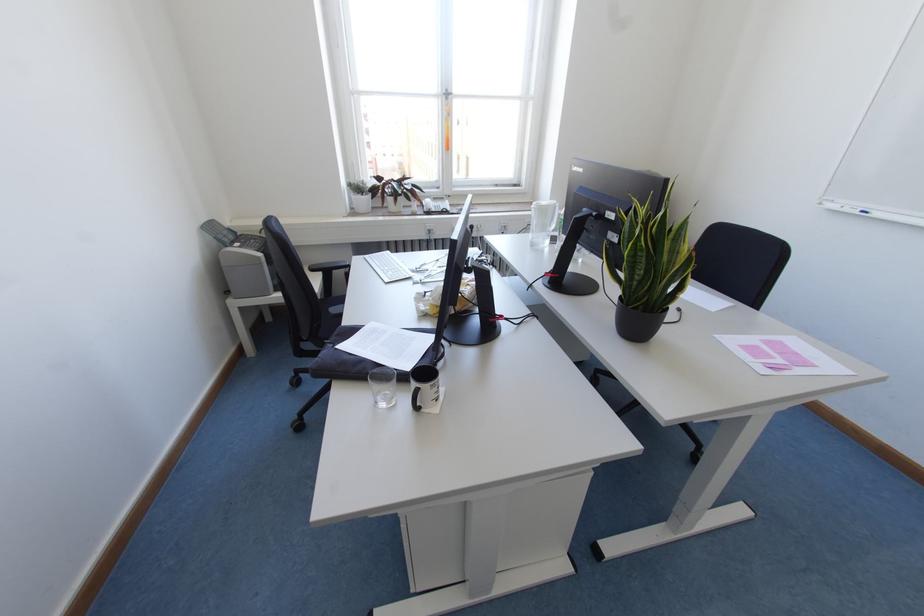
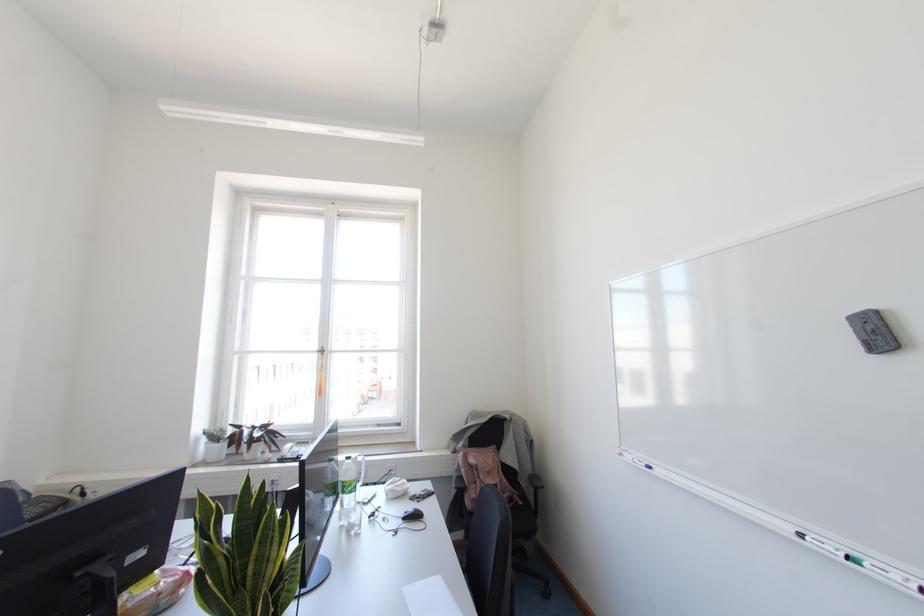
Locate, in the second image, the point that corresponds to (x=446, y=98) in the first image.

(322, 353)